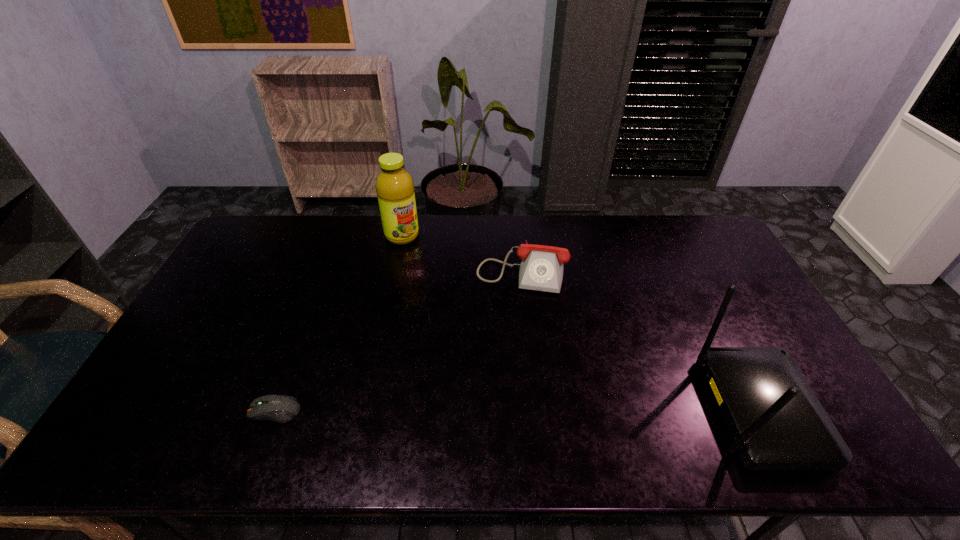
Locate an element on the screen. This screenshot has height=540, width=960. free point located on the dial of the third object from left to right is located at coordinates (498, 403).

At what (x,y) coordinates should I click in order to perform the action: click on vacant point located 0.250m on the dial of the third object from left to right. Please return your answer as a coordinate pair (x, y). Looking at the image, I should click on (505, 359).

Locate an element on the screen. Image resolution: width=960 pixels, height=540 pixels. vacant space situated 0.330m on the front label of the third object from right to left is located at coordinates (456, 301).

Locate an element on the screen. This screenshot has height=540, width=960. vacant space located 0.050m on the front label of the third object from right to left is located at coordinates (416, 253).

This screenshot has width=960, height=540. Find the location of `vacant space located 0.290m on the front label of the third object from right to left`. vacant space located 0.290m on the front label of the third object from right to left is located at coordinates (450, 293).

At what (x,y) coordinates should I click in order to perform the action: click on telephone located at the far edge. Please return your answer as a coordinate pair (x, y). This screenshot has height=540, width=960. Looking at the image, I should click on (541, 269).

What are the coordinates of `fruit juice present at the far edge` in the screenshot? It's located at (394, 185).

You are a GUI agent. You are given a task and a screenshot of the screen. Output one action in this format:
    pyautogui.click(x=<x>, y=<y>)
    Task: Click on the computer equipment that is at the near edge
    Image resolution: width=960 pixels, height=540 pixels.
    Given the screenshot: What is the action you would take?
    pyautogui.click(x=278, y=408)

This screenshot has width=960, height=540. I want to click on router at the near edge, so click(777, 423).

You are a GUI agent. You are given a task and a screenshot of the screen. Output one action in this format:
    pyautogui.click(x=<x>, y=<y>)
    Task: Click on the object that is at the right edge
    The width and height of the screenshot is (960, 540).
    Given the screenshot: What is the action you would take?
    pyautogui.click(x=777, y=423)